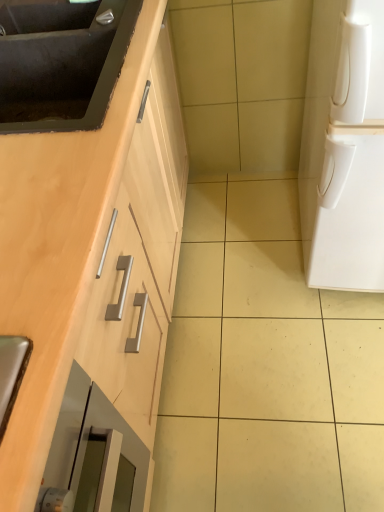
Question: Is matte black sink at upper left, which is counted as the first sink, starting from the bottom, inside the boundaries of matte black sink at upper left, positioned as the 2th sink in bottom-to-top order, or outside?

Choices:
 (A) inside
 (B) outside

Answer: (B)

Question: From a real-world perspective, is matte black sink at upper left, the 2th sink when ordered from top to bottom, positioned above or below matte black sink at upper left, positioned as the 2th sink in bottom-to-top order?

Choices:
 (A) above
 (B) below

Answer: (B)

Question: Which of these objects is positioned closest to the white matte refrigerator at right?

Choices:
 (A) matte black sink at upper left, which is counted as the first sink, starting from the bottom
 (B) matte black sink at upper left, which is the 1th sink in top-to-bottom order

Answer: (A)

Question: Estimate the real-world distances between objects in this image. Which object is closer to the white matte refrigerator at right?

Choices:
 (A) matte black sink at upper left, which is counted as the first sink, starting from the bottom
 (B) matte black sink at upper left, positioned as the 2th sink in bottom-to-top order

Answer: (A)